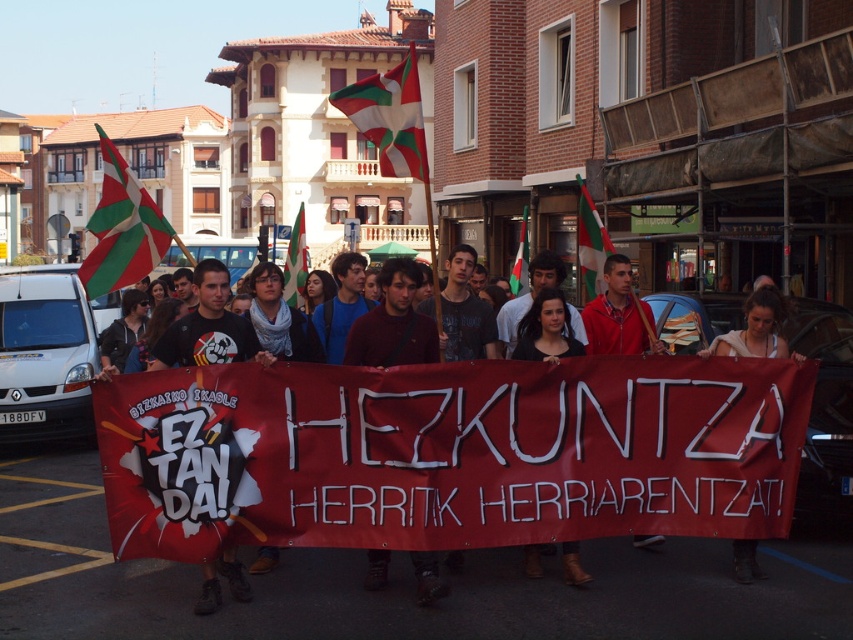
Question: Does green and white fabric flag at center have a smaller size compared to green fabric flag at center?

Choices:
 (A) no
 (B) yes

Answer: (A)

Question: Does green and white striped flag at center have a greater width compared to green and white fabric flag at center?

Choices:
 (A) yes
 (B) no

Answer: (B)

Question: Among these points, which one is nearest to the camera?

Choices:
 (A) (773, 346)
 (B) (704, 388)
 (C) (608, 244)

Answer: (B)

Question: Among these objects, which one is farthest from the camera?

Choices:
 (A) green and white striped flag at upper left
 (B) matte black t-shirt at center
 (C) green and white striped flag at center
 (D) green fabric flag at center

Answer: (D)

Question: Which object is the closest to the green and white fabric flag at center?

Choices:
 (A) green and white striped flag at upper center
 (B) white fabric banner at center

Answer: (A)

Question: Can you confirm if matte black t-shirt at center is positioned above green and white fabric flag at center?

Choices:
 (A) yes
 (B) no

Answer: (B)